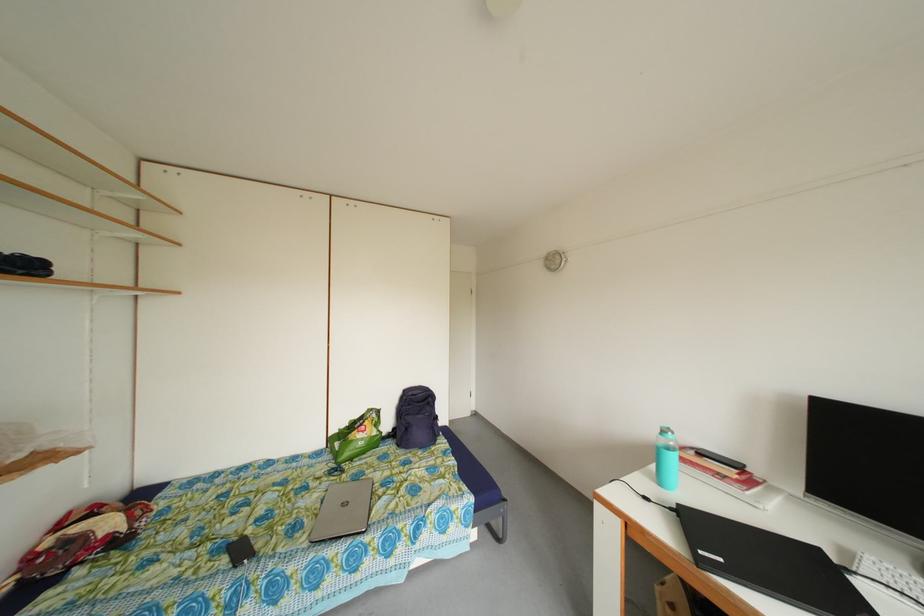
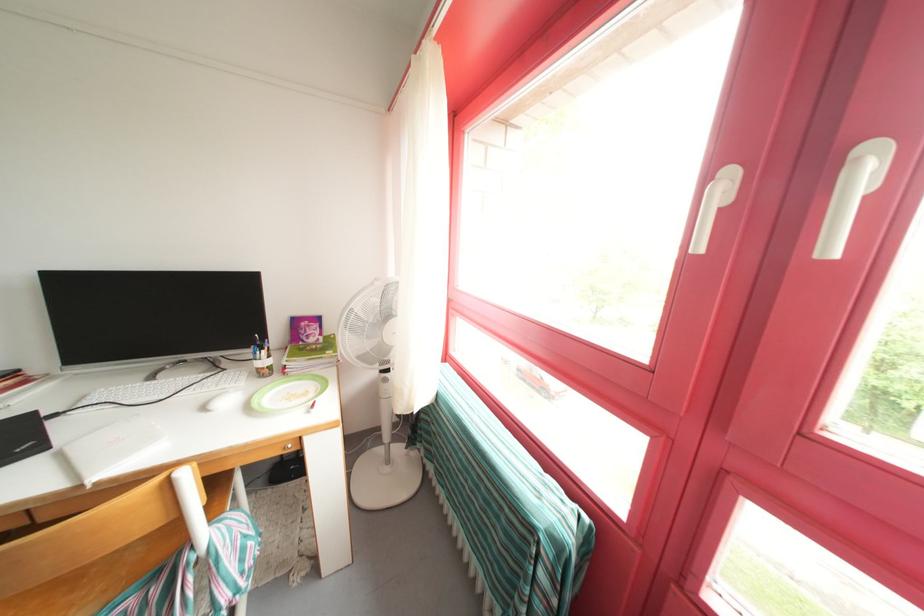
First-person continuous shooting, in which direction is the camera rotating?

The camera rotated toward right-down.